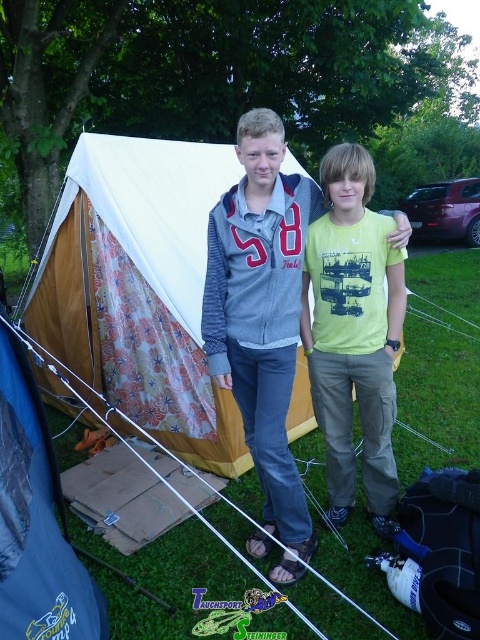
Question: Which point is closer to the camera taking this photo?

Choices:
 (A) (386, 445)
 (B) (128, 260)

Answer: (A)

Question: Does gray fleece jacket at center have a greater width compared to yellow cotton t-shirt at center?

Choices:
 (A) yes
 (B) no

Answer: (A)

Question: Can you confirm if gray fleece jacket at center is positioned above yellow cotton t-shirt at center?

Choices:
 (A) yes
 (B) no

Answer: (A)

Question: Among these objects, which one is farthest from the camera?

Choices:
 (A) yellow cotton t-shirt at center
 (B) floral fabric tent at center
 (C) blue tarpaulin tent at center

Answer: (B)

Question: Which object appears closest to the camera in this image?

Choices:
 (A) yellow cotton t-shirt at center
 (B) floral fabric tent at center
 (C) blue tarpaulin tent at center
 (D) gray fleece jacket at center

Answer: (C)

Question: Does floral fabric tent at center have a greater width compared to blue tarpaulin tent at center?

Choices:
 (A) no
 (B) yes

Answer: (B)